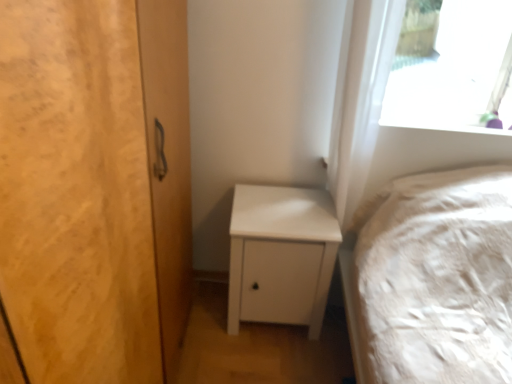
Find the location of `free space in front of white matte nightstand at lower center`. free space in front of white matte nightstand at lower center is located at coordinates (266, 365).